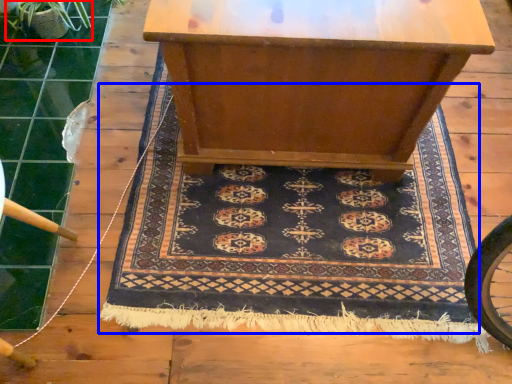
Question: Which object is further to the camera taking this photo, plant (highlighted by a red box) or mat (highlighted by a blue box)?

Choices:
 (A) plant
 (B) mat

Answer: (A)